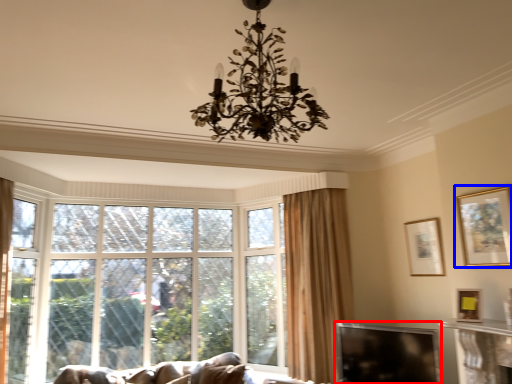
Question: Among these objects, which one is farthest to the camera, window screen (highlighted by a red box) or picture frame (highlighted by a blue box)?

Choices:
 (A) window screen
 (B) picture frame

Answer: (A)